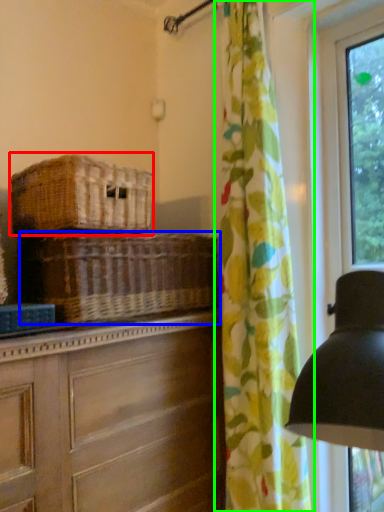
Question: Estimate the real-world distances between objects in this image. Which object is farther from basket (highlighted by a red box), basket (highlighted by a blue box) or curtain (highlighted by a green box)?

Choices:
 (A) basket
 (B) curtain

Answer: (B)